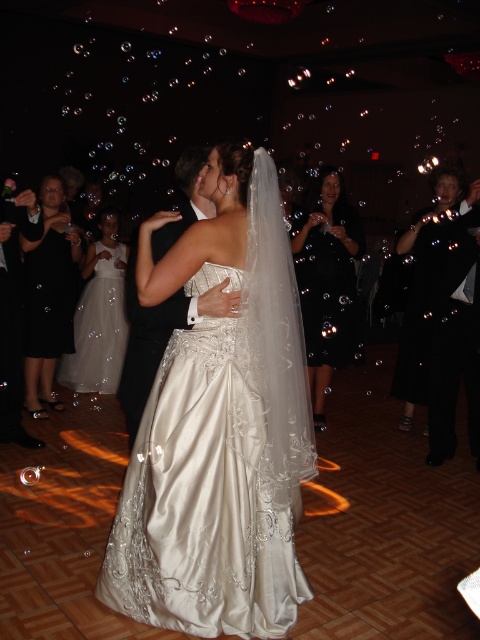
Question: Which object is closer to the camera taking this photo?

Choices:
 (A) black satin suit at center
 (B) black satin dress at right

Answer: (A)

Question: In this image, where is satin/embroidered dress at center located relative to black satin dress at center?

Choices:
 (A) left
 (B) right

Answer: (A)

Question: Does satin/embroidered dress at center have a lesser width compared to black satin suit at center?

Choices:
 (A) yes
 (B) no

Answer: (B)

Question: Among these objects, which one is nearest to the camera?

Choices:
 (A) black satin dress at right
 (B) white satin dress at center
 (C) black satin dress at left

Answer: (A)

Question: Among these objects, which one is farthest from the camera?

Choices:
 (A) black satin suit at center
 (B) white satin dress at center
 (C) black satin dress at right
 (D) black satin dress at center

Answer: (B)

Question: Can you confirm if black satin dress at right is bigger than black satin suit at center?

Choices:
 (A) no
 (B) yes

Answer: (B)